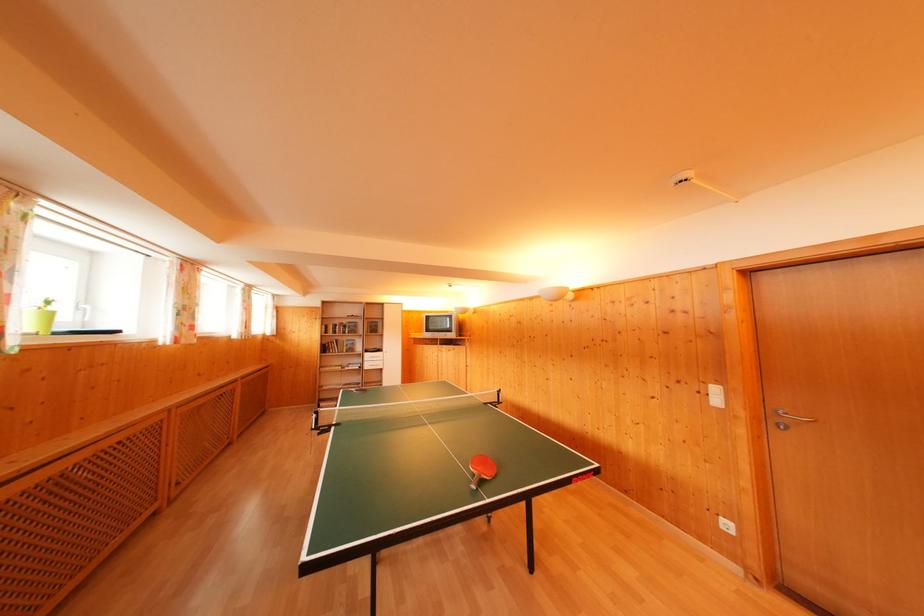
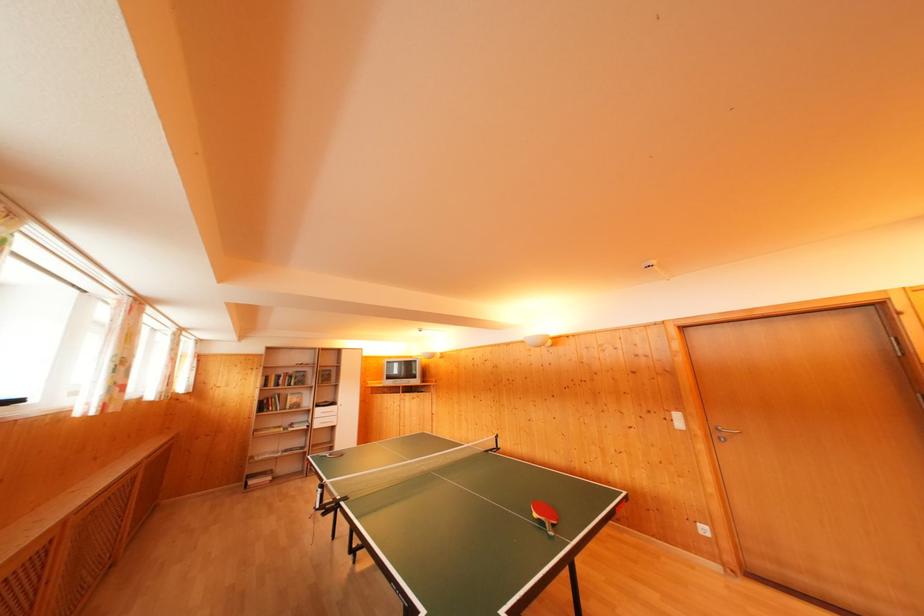
Locate, in the second image, the point that corresponds to point 721,395 in the first image.

(682, 421)